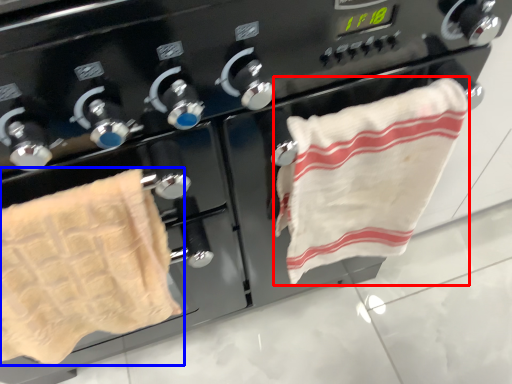
Question: Which point is further to the camera, towel (highlighted by a red box) or towel (highlighted by a blue box)?

Choices:
 (A) towel
 (B) towel

Answer: (A)